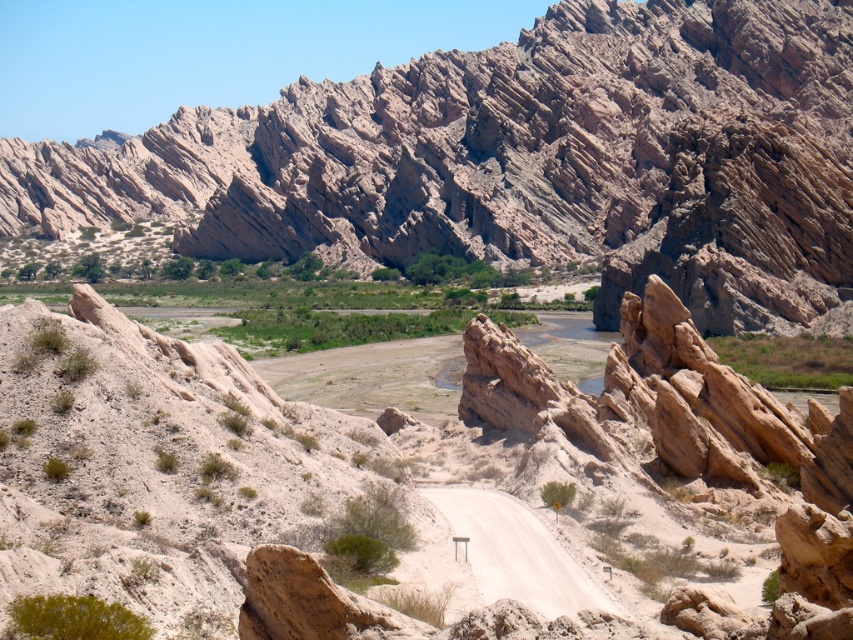
You are a hiker planning to walk along the white sandy dirt road at center. There is a rustic rock formation at upper center in your path. Can you walk straight ahead without going around it?

The white sandy dirt road at center is behind rustic rock formation at upper center, so you cannot walk straight ahead without going around it because the rock formation is blocking your path.

You are a hiker trying to decide whether to walk along the white sandy dirt road at center or go around the rustic rock formation at upper center. Which path would require more space to navigate?

The rustic rock formation at upper center might be wider than the white sandy dirt road at center, so navigating around it could require more space compared to staying on the narrower road.